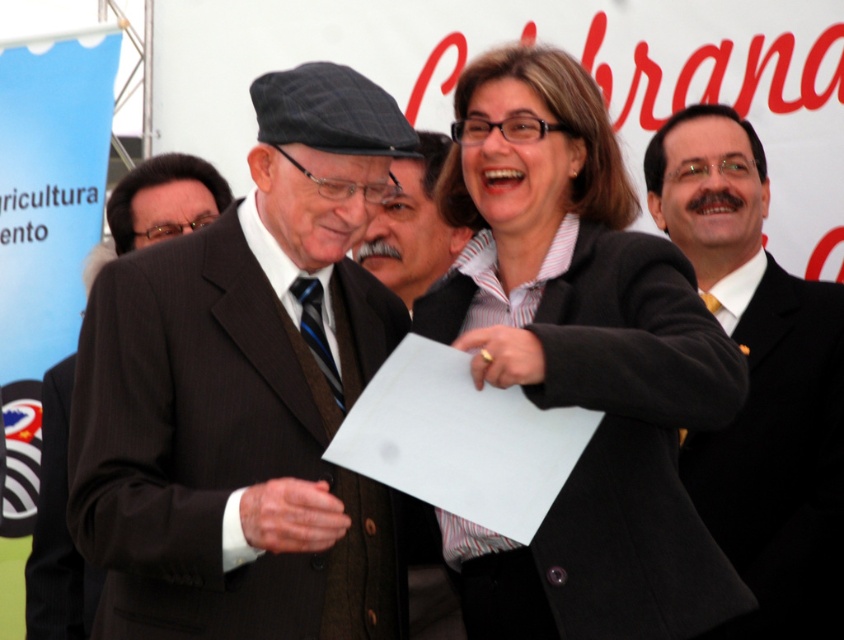
Question: Is matte black blazer at center thinner than matte black suit at center?

Choices:
 (A) no
 (B) yes

Answer: (A)

Question: Is matte black blazer at center bigger than dark brown pinstripe suit at center?

Choices:
 (A) yes
 (B) no

Answer: (A)

Question: Which object is closer to the camera taking this photo?

Choices:
 (A) matte black suit at center
 (B) gray woolen hat at center
 (C) dark brown wool suit at lower left
 (D) matte black blazer at center

Answer: (D)

Question: Estimate the real-world distances between objects in this image. Which object is farther from the dark brown wool suit at lower left?

Choices:
 (A) matte black suit at center
 (B) dark brown suit at center

Answer: (A)

Question: Which point is farther to the camera?

Choices:
 (A) matte black suit at center
 (B) dark brown suit at center
 (C) dark brown pinstripe suit at center

Answer: (C)

Question: Is matte black blazer at center below matte black suit at center?

Choices:
 (A) yes
 (B) no

Answer: (B)